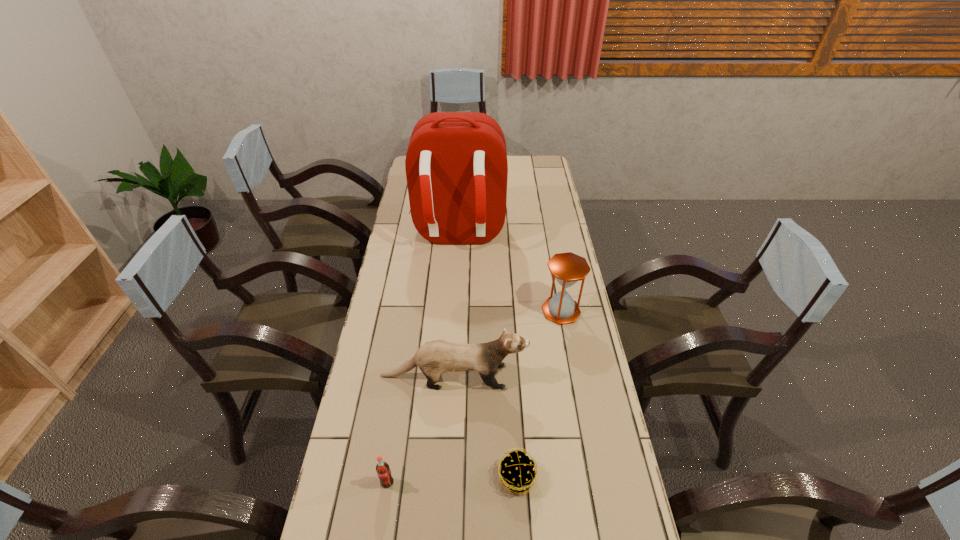
Image resolution: width=960 pixels, height=540 pixels. Find the location of `vacant area that satisfies the following two spatial constraints: 1. on the face of the third farthest object; 2. on the label of the fourth tallest object`. vacant area that satisfies the following two spatial constraints: 1. on the face of the third farthest object; 2. on the label of the fourth tallest object is located at coordinates (447, 483).

The image size is (960, 540). I want to click on free space that satisfies the following two spatial constraints: 1. on the front side of the fourth nearest object; 2. on the face of the third farthest object, so click(573, 376).

Identify the location of vacant point that satisfies the following two spatial constraints: 1. on the face of the ferret; 2. on the label of the soda bottle. (447, 483).

Locate an element on the screen. The height and width of the screenshot is (540, 960). free point that satisfies the following two spatial constraints: 1. on the face of the ferret; 2. on the label of the soda bottle is located at coordinates (447, 483).